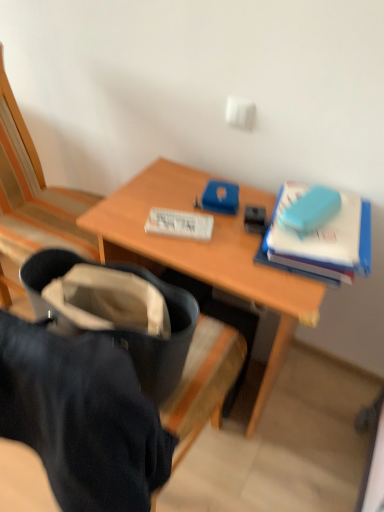
Question: From the image's perspective, relative to wooden chair at left, is black fabric bag at center above or below?

Choices:
 (A) above
 (B) below

Answer: (B)

Question: Is point (142, 394) positioned closer to the camera than point (61, 231)?

Choices:
 (A) farther
 (B) closer

Answer: (B)

Question: Which of these objects is positioned farthest from the wooden desk at center?

Choices:
 (A) blue matte book at upper right, arranged as the second paperback book when viewed from the left
 (B) black fabric bag at center
 (C) wooden chair at left
 (D) white paper at center, which appears as the second paperback book when viewed from the right

Answer: (B)

Question: Which of these objects is positioned closest to the wooden chair at left?

Choices:
 (A) white paper at center, which appears as the second paperback book when viewed from the right
 (B) black fabric bag at center
 (C) wooden desk at center
 (D) blue matte book at upper right, arranged as the second paperback book when viewed from the left

Answer: (C)